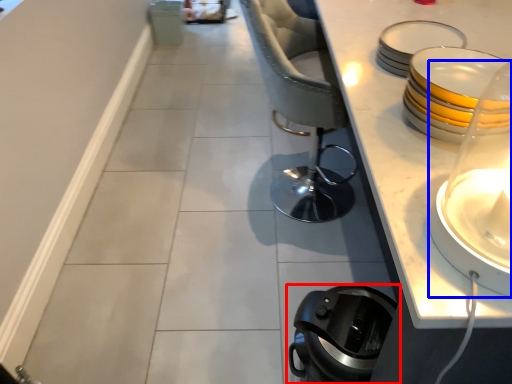
Question: Which object appears farthest to the camera in this image, home appliance (highlighted by a red box) or candle holder (highlighted by a blue box)?

Choices:
 (A) home appliance
 (B) candle holder

Answer: (A)